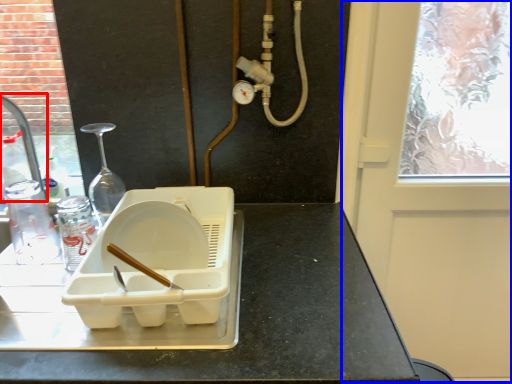
Question: Which object is closer to the camera taking this photo, faucet (highlighted by a red box) or screen door (highlighted by a blue box)?

Choices:
 (A) faucet
 (B) screen door

Answer: (B)